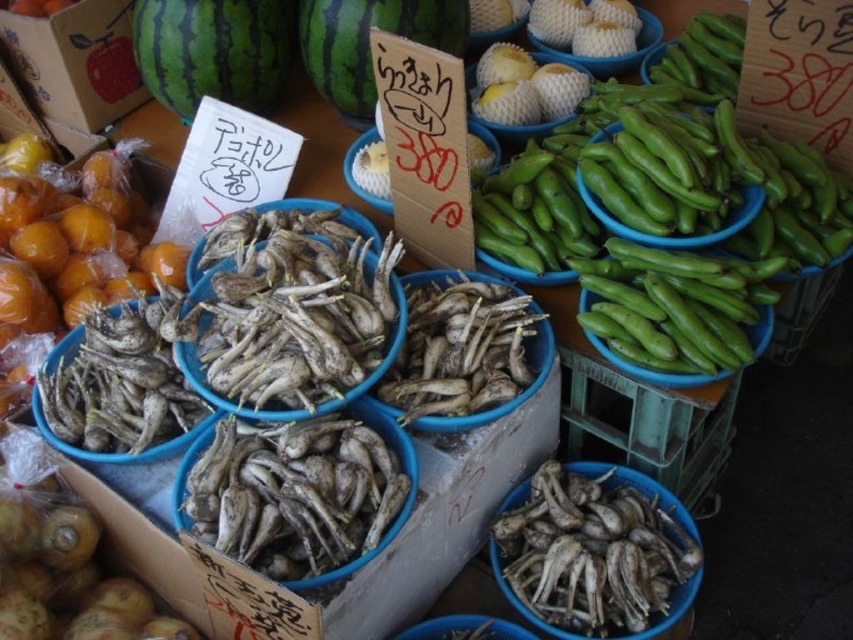
Which is in front, point (537, 570) or point (247, 92)?

Point (537, 570) is in front.

Can you confirm if white matte root vegetables at lower center is positioned below green striped watermelon at upper left?

Yes, white matte root vegetables at lower center is below green striped watermelon at upper left.

The height and width of the screenshot is (640, 853). In order to click on white matte root vegetables at lower center in this screenshot , I will do `click(595, 552)`.

Between point (190, 19) and point (299, 16), which one is positioned behind?

Point (299, 16)

Who is taller, green striped watermelon at upper left or green striped watermelon at upper center?

Standing taller between the two is green striped watermelon at upper left.

Locate an element on the screen. green striped watermelon at upper left is located at coordinates (212, 51).

Does white matte root vegetables at lower center have a lesser height compared to green striped watermelon at upper center?

In fact, white matte root vegetables at lower center may be taller than green striped watermelon at upper center.

Is white matte root vegetables at lower center positioned before green striped watermelon at upper center?

Yes, white matte root vegetables at lower center is in front of green striped watermelon at upper center.

Where is `white matte root vegetables at lower center`? white matte root vegetables at lower center is located at coordinates (595, 552).

Locate an element on the screen. white matte root vegetables at lower center is located at coordinates (595, 552).